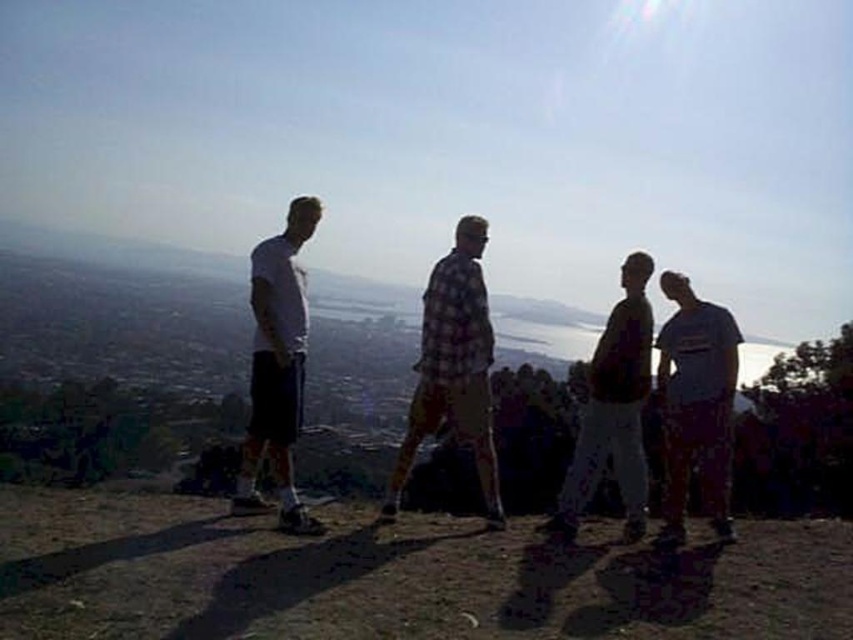
You are standing on the hilltop and want to take a photo of both the point at coordinates [418,444] and the point at coordinates [685,419] in the scene. Which point will appear closer to the bottom of the photo frame?

The point at coordinates [685,419] will appear closer to the bottom of the photo frame because it is closer to the camera than the point at coordinates [418,444].